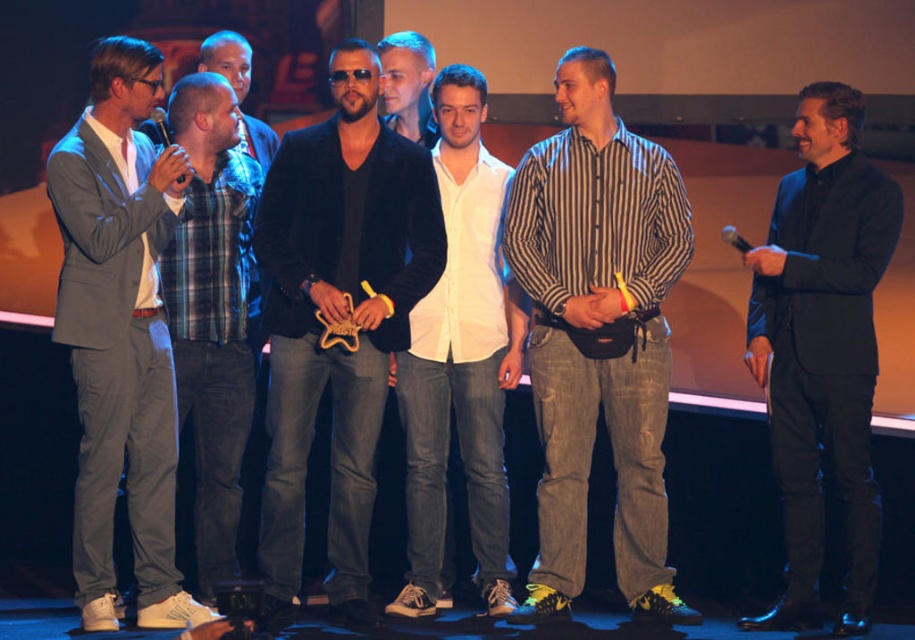
You are standing at the center of the stage and need to hand a document to the person wearing the gray suit at left. Based on their position, in which direction should you move to reach them?

The gray suit at left is located at point 0.523 on the x and 0.132 on the y coordinate, so you should move to the left and slightly forward to reach them.

You are attending an event and need to identify the clothing items based on their sizes. Which clothing item is smaller between the gray suit at left and the white shirt at center?

The gray suit at left is smaller than the white shirt at center according to the description provided.